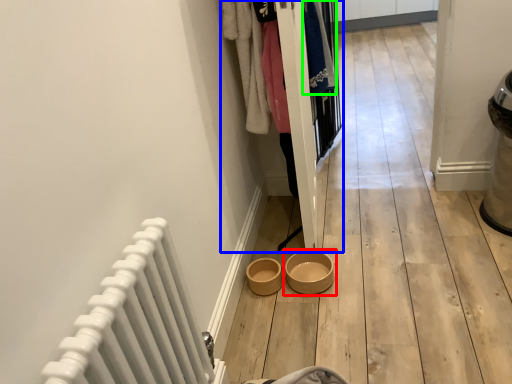
Question: Which object is positioned farthest from bowl (highlighted by a red box)? Select from closet (highlighted by a blue box) and clothing (highlighted by a green box).

Choices:
 (A) closet
 (B) clothing

Answer: (B)